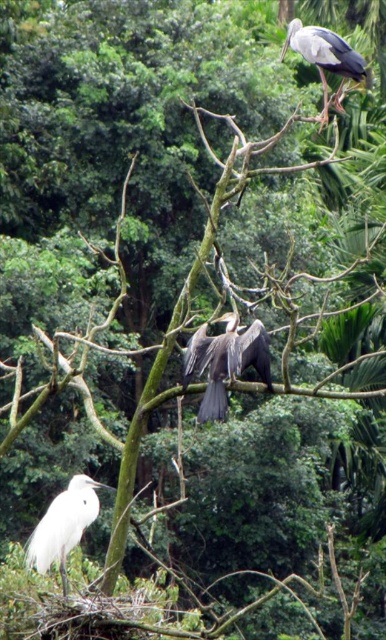
You are standing in the forest looking at the tree with two points marked on it. Which of the two points, point [269,368] or point [353,72], is closer to you?

Point [269,368] is closer to the viewer than point [353,72].

You are an ornithologist observing the birds in the forest scene. You notice two birds of interest. The first is the dark brown feathers at center, and the second is the white feathered bird at lower left. Which of these two birds appears wider in the image?

The white feathered bird at lower left appears wider than the dark brown feathers at center, as the description states that the dark brown feathers at center has a lesser width compared to the white feathered bird at lower left.

In the scene shown: You are a birdwatcher trying to capture a photo of the dark brown feathers at center and the gray matte bird at upper right in the same frame. Given that your camera has a maximum focus range of 15 feet, will you be able to capture both birds in focus simultaneously?

The distance between the dark brown feathers at center and the gray matte bird at upper right is 16.01 feet, which exceeds the camera focus range of 15 feet. Therefore, you cannot capture both birds in focus simultaneously.